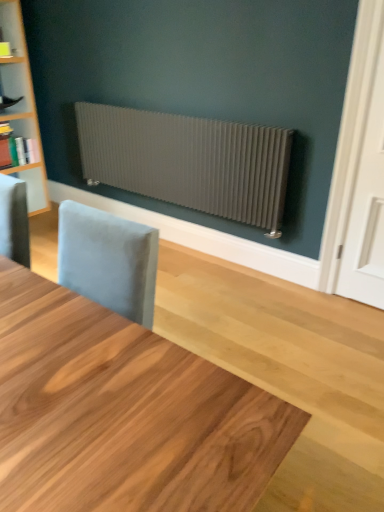
Question: Considering the positions of matte white bookshelf at left and light wood table at center in the image, is matte white bookshelf at left wider or thinner than light wood table at center?

Choices:
 (A) wide
 (B) thin

Answer: (B)

Question: Is matte white bookshelf at left inside the boundaries of light wood table at center, or outside?

Choices:
 (A) inside
 (B) outside

Answer: (B)

Question: Considering the real-world distances, which object is farthest from the light wood table at center?

Choices:
 (A) matte white bookshelf at left
 (B) satin silver radiator at upper center

Answer: (A)

Question: Which object is the closest to the satin silver radiator at upper center?

Choices:
 (A) matte white bookshelf at left
 (B) light wood table at center

Answer: (A)